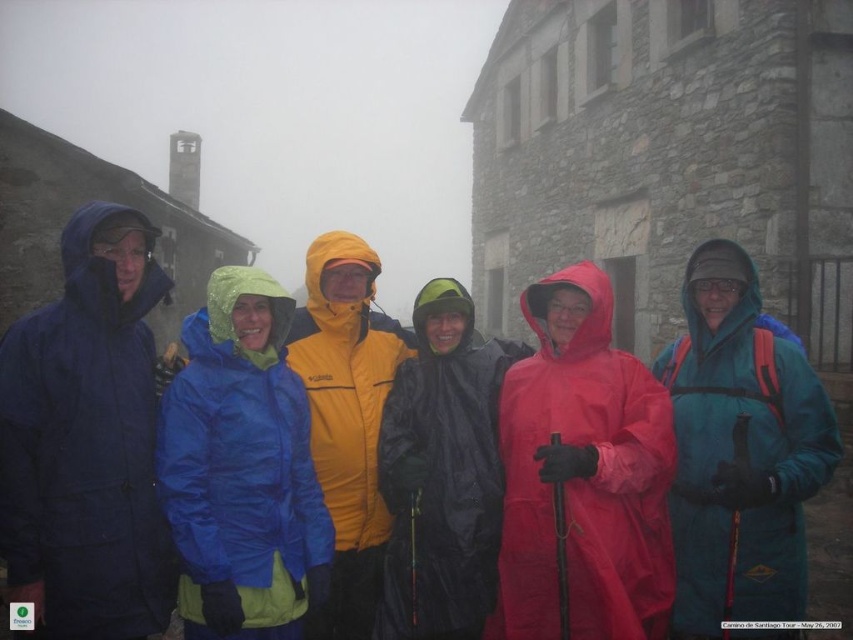
You are trying to decide which waterproof jacket to choose between the blue waterproof jacket at center and the black waterproof jacket at center based on their width. According to the description, which one is wider?

The blue waterproof jacket at center might be wider than black waterproof jacket at center.

You are a photographer trying to capture the group of six individuals in the image. You notice a specific point at coordinates (442, 472). Based on the scene description, which person wearing a waterproof jacket is located at this point?

The point at coordinates (442, 472) indicates the location of the black waterproof jacket at center.

You are a photographer trying to capture a group photo of the six people in the image. You notice the blue waterproof jacket at center and the black waterproof jacket at center. Which jacket should you adjust to ensure both are fully visible in the photo?

The blue waterproof jacket at center is located below the black waterproof jacket at center, so you should adjust the blue waterproof jacket at center to move it upwards or the black waterproof jacket at center to move it downwards to ensure both are fully visible in the photo.